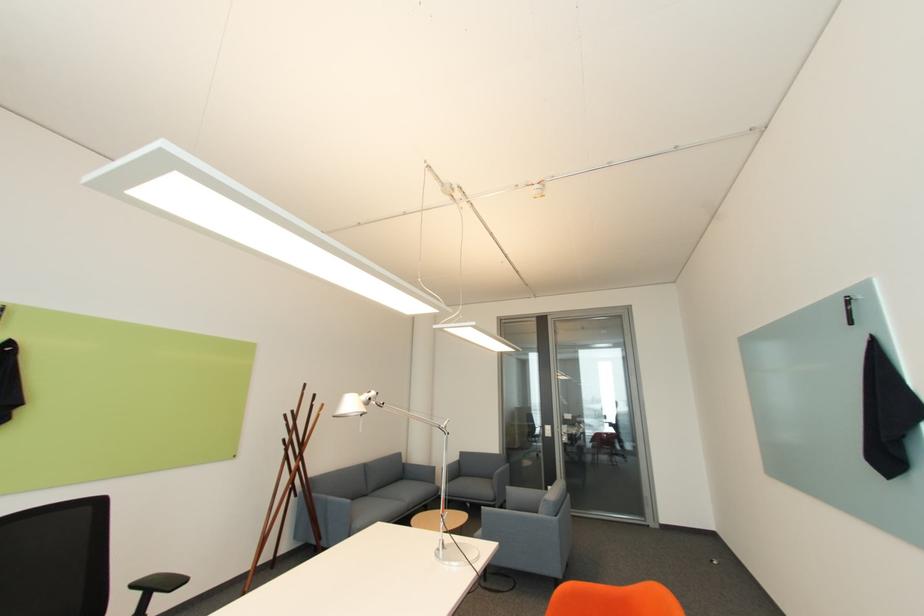
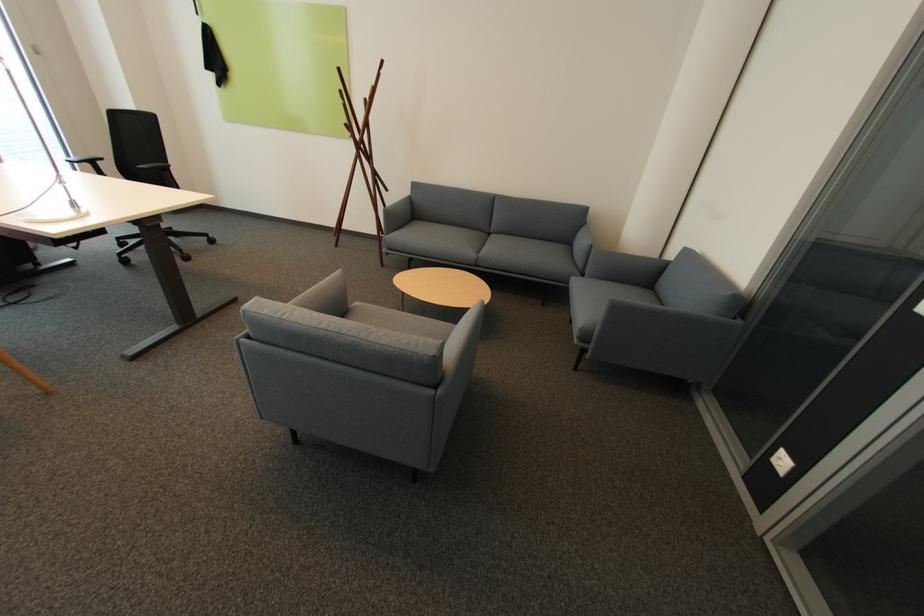
Where in the second image is the point corresponding to the point at 415,512 from the first image?

(482, 265)